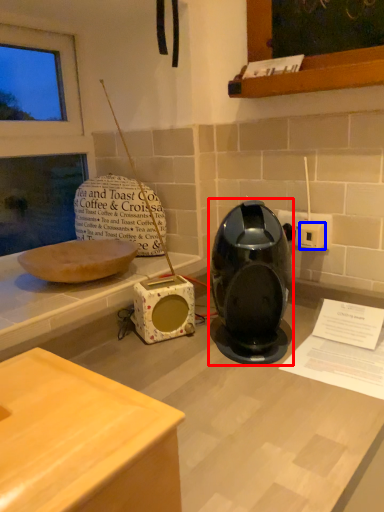
Question: Which object is closer to the camera taking this photo, home appliance (highlighted by a red box) or electric outlet (highlighted by a blue box)?

Choices:
 (A) home appliance
 (B) electric outlet

Answer: (A)